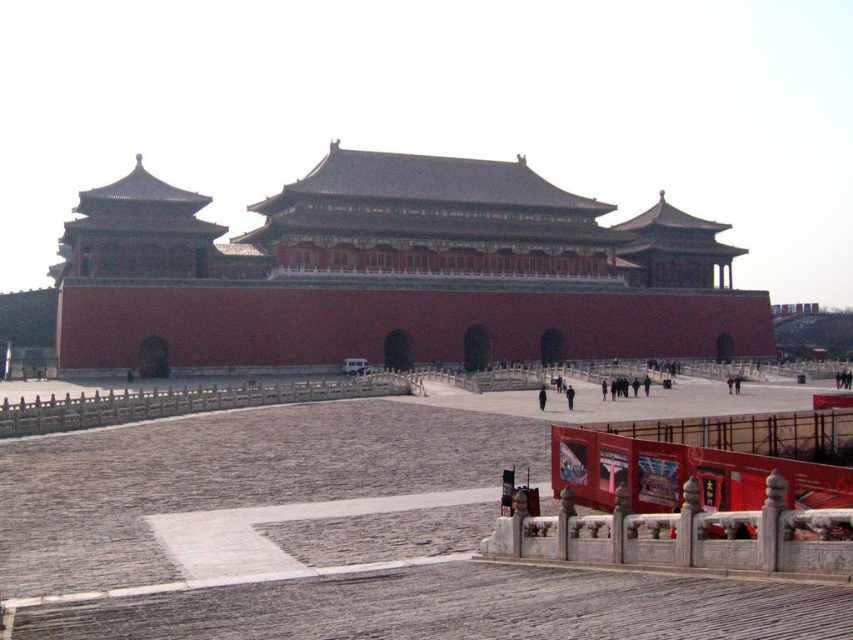
Can you confirm if smooth red wall at center is shorter than black fabric person at center?

No.

Between point (247, 365) and point (567, 392), which one is positioned in front?

Point (567, 392) is more forward.

Measure the distance between smooth red wall at center and camera.

smooth red wall at center and camera are 80.41 meters apart.

You are a GUI agent. You are given a task and a screenshot of the screen. Output one action in this format:
    pyautogui.click(x=<x>, y=<y>)
    Task: Click on the smooth red wall at center
    
    Given the screenshot: What is the action you would take?
    pyautogui.click(x=393, y=273)

Which is above, gray stone plaza at center or black fabric person at center?

gray stone plaza at center

Can you confirm if gray stone plaza at center is positioned below black fabric person at center?

No, gray stone plaza at center is not below black fabric person at center.

Who is more forward, (368, 570) or (572, 396)?

Point (368, 570) is more forward.

Locate an element on the screen. Image resolution: width=853 pixels, height=640 pixels. gray stone plaza at center is located at coordinates (346, 525).

You are a GUI agent. You are given a task and a screenshot of the screen. Output one action in this format:
    pyautogui.click(x=<x>, y=<y>)
    Task: Click on the gray stone plaza at center
    The image size is (853, 640).
    Given the screenshot: What is the action you would take?
    pyautogui.click(x=346, y=525)

Can you confirm if gray stone plaza at center is taller than dark blue fabric at center?

Correct, gray stone plaza at center is much taller as dark blue fabric at center.

Between point (345, 636) and point (540, 388), which one is positioned in front?

Positioned in front is point (345, 636).

I want to click on gray stone plaza at center, so click(x=346, y=525).